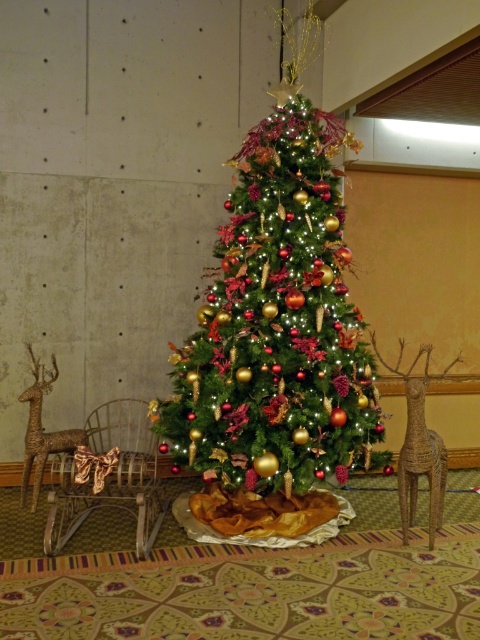
Question: Observing the image, what is the correct spatial positioning of shiny gold ornaments at center in reference to rustic brown deer at left?

Choices:
 (A) left
 (B) right

Answer: (B)

Question: Can you confirm if shiny gold ornaments at center is smaller than woven wood reindeer at right?

Choices:
 (A) yes
 (B) no

Answer: (B)

Question: Estimate the real-world distances between objects in this image. Which object is farther from the woven wood reindeer at right?

Choices:
 (A) rustic brown deer at left
 (B) shiny gold ornaments at center

Answer: (A)

Question: Which object is the closest to the shiny gold ornaments at center?

Choices:
 (A) woven wood reindeer at right
 (B) rustic brown deer at left

Answer: (A)

Question: Considering the real-world distances, which object is closest to the rustic brown deer at left?

Choices:
 (A) woven wood reindeer at right
 (B) shiny gold ornaments at center

Answer: (B)

Question: In this image, where is shiny gold ornaments at center located relative to rustic brown deer at left?

Choices:
 (A) below
 (B) above

Answer: (B)